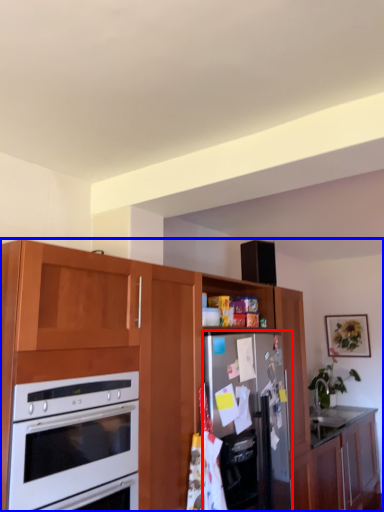
Question: Among these objects, which one is farthest to the camera, refrigerator (highlighted by a red box) or cabinetry (highlighted by a blue box)?

Choices:
 (A) refrigerator
 (B) cabinetry

Answer: (A)